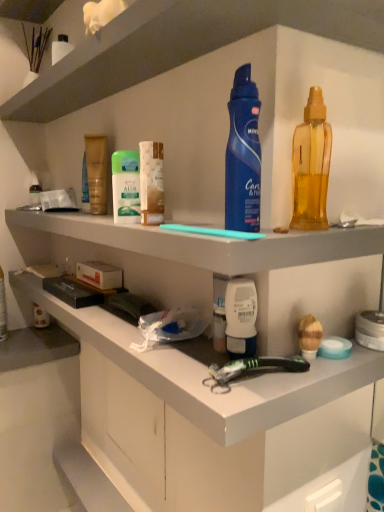
Locate an element on the screen. vacant area to the left of blue matte deodorant at center, which ranks as the first cleaning product in left-to-right order is located at coordinates (164, 229).